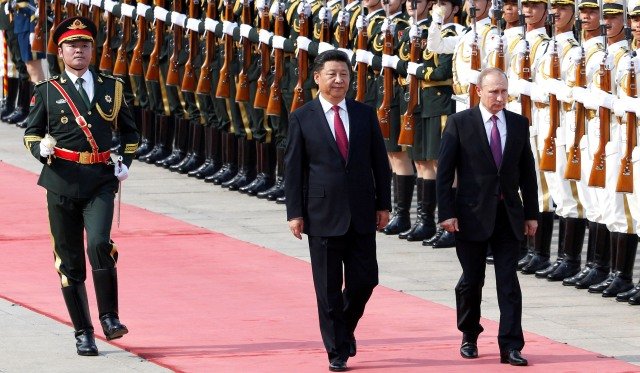
Where is `red carpet`? red carpet is located at coordinates (221, 265).